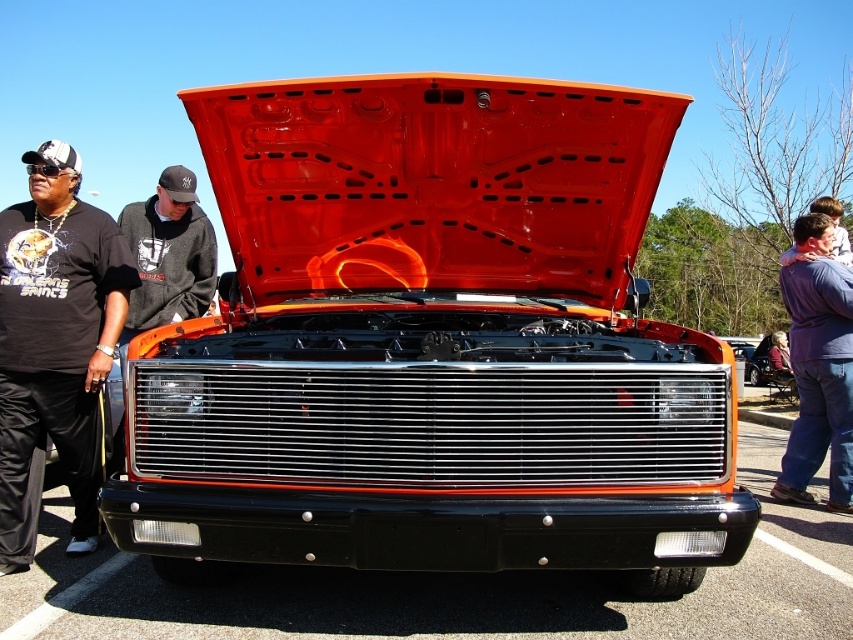
You are a photographer wanting to capture the shiny chrome grille at center and the black plastic bumper at center in a single shot. Which object will appear larger in the photo?

The shiny chrome grille at center will appear larger in the photo because it is closer to the viewer than the black plastic bumper at center.

You are a mechanic working on a classic car. You notice the black plastic bumper at center and the blue denim jeans at right. Which object is located lower in the image?

The black plastic bumper at center is positioned under the blue denim jeans at right, so it is lower in the image.

You are a mechanic working on the car. You need to determine if the black plastic bumper at center can fit into a storage container that is the same height as the blue denim jeans at right. Can it fit?

The black plastic bumper at center is not as tall as blue denim jeans at right, so it can fit into the container since it is shorter.